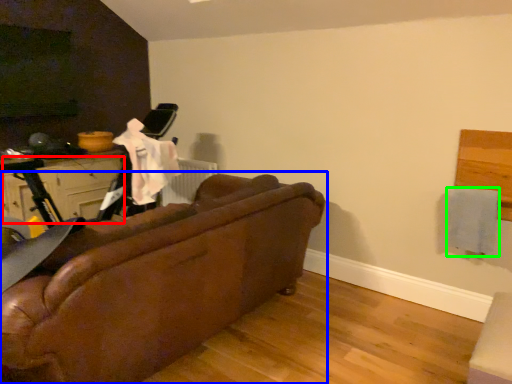
Question: Based on their relative distances, which object is nearer to drawer (highlighted by a red box)? Choose from studio couch (highlighted by a blue box) and clothe (highlighted by a green box).

Choices:
 (A) studio couch
 (B) clothe

Answer: (A)